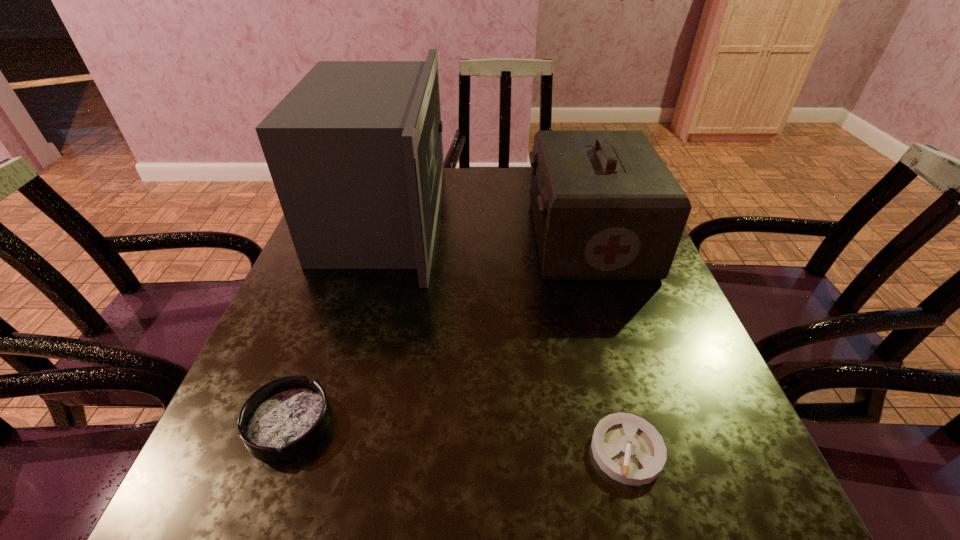
Find the location of a particular element. The image size is (960, 540). microwave oven situated at the far edge is located at coordinates (354, 150).

Image resolution: width=960 pixels, height=540 pixels. Identify the location of the first-aid kit at the far edge. (605, 206).

At what (x,y) coordinates should I click in order to perform the action: click on object that is at the near edge. Please return your answer as a coordinate pair (x, y). Image resolution: width=960 pixels, height=540 pixels. Looking at the image, I should click on (630, 450).

Where is `microwave oven that is at the left edge`? This screenshot has width=960, height=540. microwave oven that is at the left edge is located at coordinates (354, 150).

Where is `ashtray at the left edge`? The width and height of the screenshot is (960, 540). ashtray at the left edge is located at coordinates click(284, 418).

Find the location of `the first-aid kit that is at the right edge`. the first-aid kit that is at the right edge is located at coordinates (605, 206).

You are a GUI agent. You are given a task and a screenshot of the screen. Output one action in this format:
    pyautogui.click(x=<x>, y=<y>)
    Task: Click on the ashtray that is at the right edge
    
    Given the screenshot: What is the action you would take?
    pyautogui.click(x=630, y=450)

What are the coordinates of `object that is at the far left corner` in the screenshot? It's located at (354, 150).

Identify the location of object that is at the far right corner. The height and width of the screenshot is (540, 960). (605, 206).

This screenshot has height=540, width=960. Find the location of `object positioned at the near right corner`. object positioned at the near right corner is located at coordinates (630, 450).